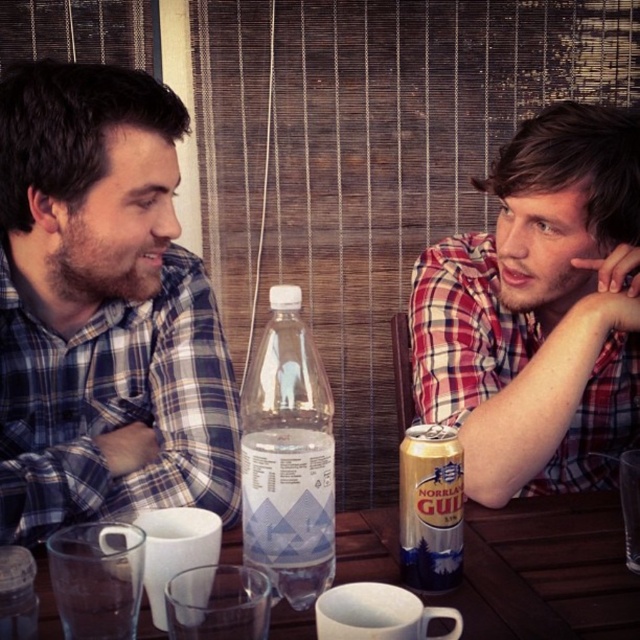
Question: Is red plaid shirt at right above transparent plastic bottle at center?

Choices:
 (A) yes
 (B) no

Answer: (A)

Question: Which point appears farthest from the camera in this image?

Choices:
 (A) (x=442, y=548)
 (B) (x=579, y=476)

Answer: (B)

Question: Can you confirm if matte plaid shirt at left is positioned above transparent plastic bottle at center?

Choices:
 (A) yes
 (B) no

Answer: (A)

Question: Based on their relative distances, which object is nearer to the transparent plastic table at center?

Choices:
 (A) transparent plastic bottle at center
 (B) red plaid shirt at right

Answer: (A)

Question: Observing the image, what is the correct spatial positioning of red plaid shirt at right in reference to transparent plastic bottle at center?

Choices:
 (A) right
 (B) left

Answer: (A)

Question: Which of the following is the farthest from the observer?

Choices:
 (A) gold aluminum can at center
 (B) transparent plastic bottle at center

Answer: (A)